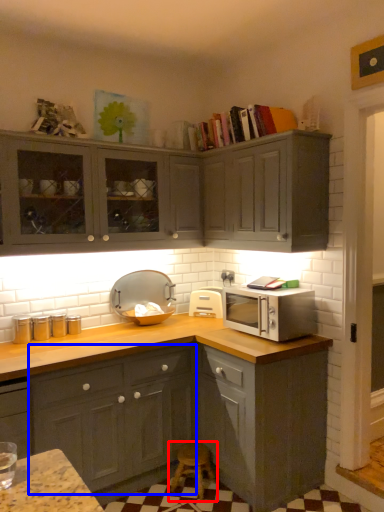
Question: Which point is closer to the camera, step stool (highlighted by a red box) or cabinetry (highlighted by a blue box)?

Choices:
 (A) step stool
 (B) cabinetry

Answer: (B)